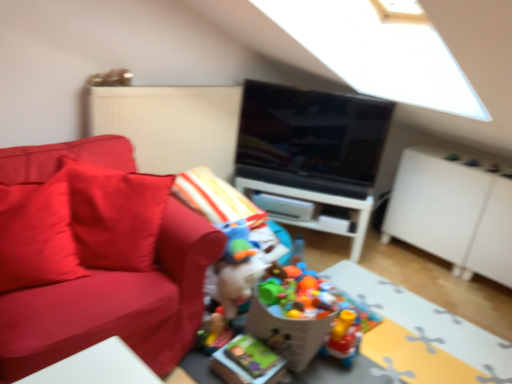
I want to click on free region on the left part of white matte dresser at right, so click(389, 258).